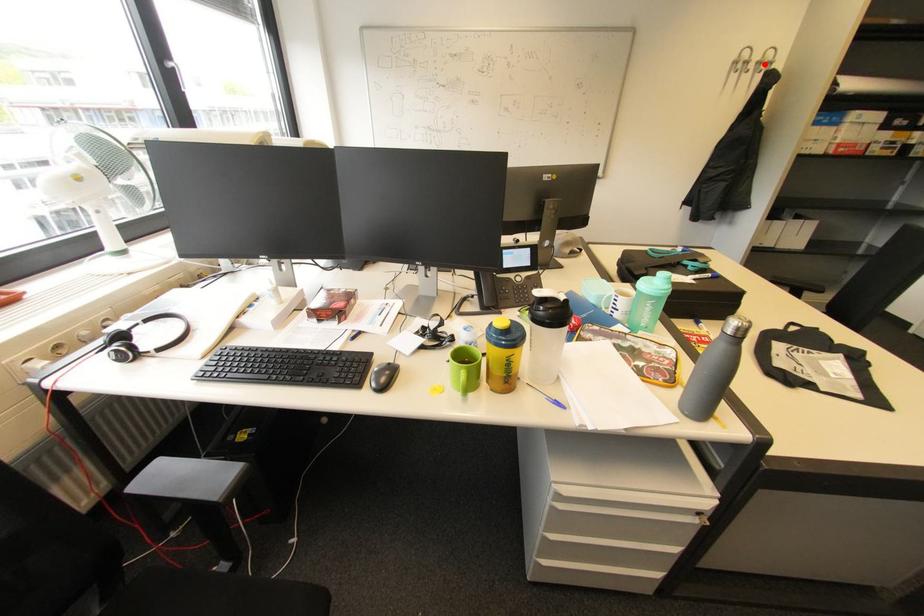
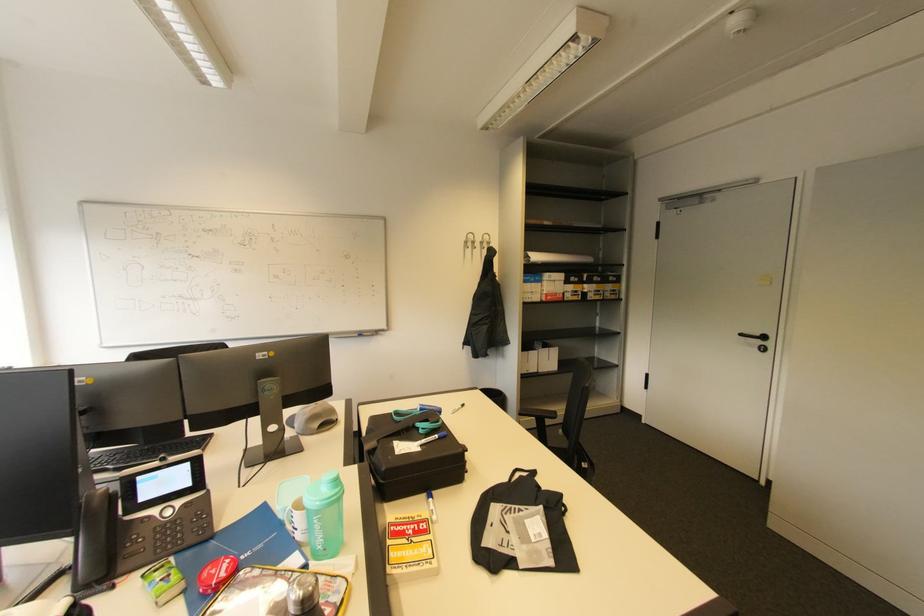
Question: I am providing you with two images of the same scene from different viewpoints. Image1 has a red point marked. In image2, the corresponding 3D location appears at what relative position? Reply with the corresponding letter.

Choices:
 (A) Closer
 (B) Farther

Answer: (A)